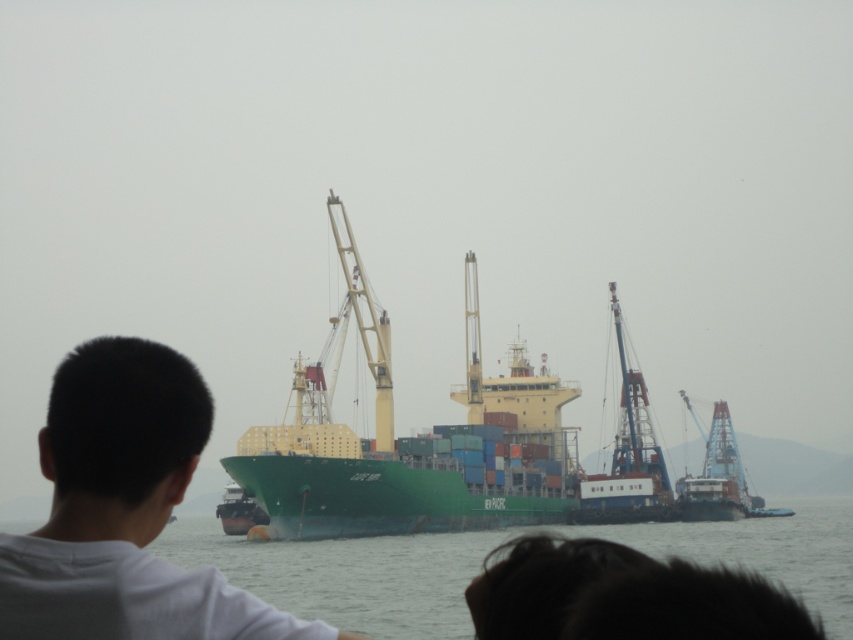
Does white matte shirt at center appear on the right side of green matte water at center?

No, white matte shirt at center is not to the right of green matte water at center.

Does white matte shirt at center have a larger size compared to green matte water at center?

No.

Who is more forward, (99, 410) or (331, 593)?

Point (99, 410) is more forward.

At what (x,y) coordinates should I click in order to perform the action: click on white matte shirt at center. Please return your answer as a coordinate pair (x, y). The width and height of the screenshot is (853, 640). Looking at the image, I should click on point(125,509).

Looking at this image, can you confirm if white matte shirt at center is positioned below yellow metallic crane at center?

Correct, white matte shirt at center is located below yellow metallic crane at center.

Which is in front, point (138, 508) or point (364, 282)?

Point (138, 508) is more forward.

Where is `white matte shirt at center`? white matte shirt at center is located at coordinates (125, 509).

Locate an element on the screen. green matte water at center is located at coordinates (497, 545).

The image size is (853, 640). Identify the location of green matte water at center. (497, 545).

Locate an element on the screen. The height and width of the screenshot is (640, 853). green matte water at center is located at coordinates (497, 545).